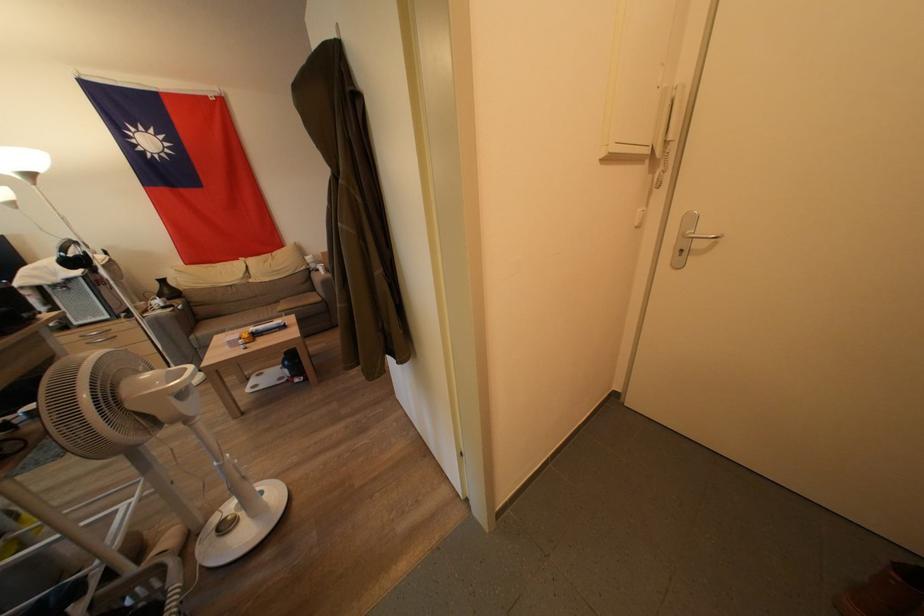
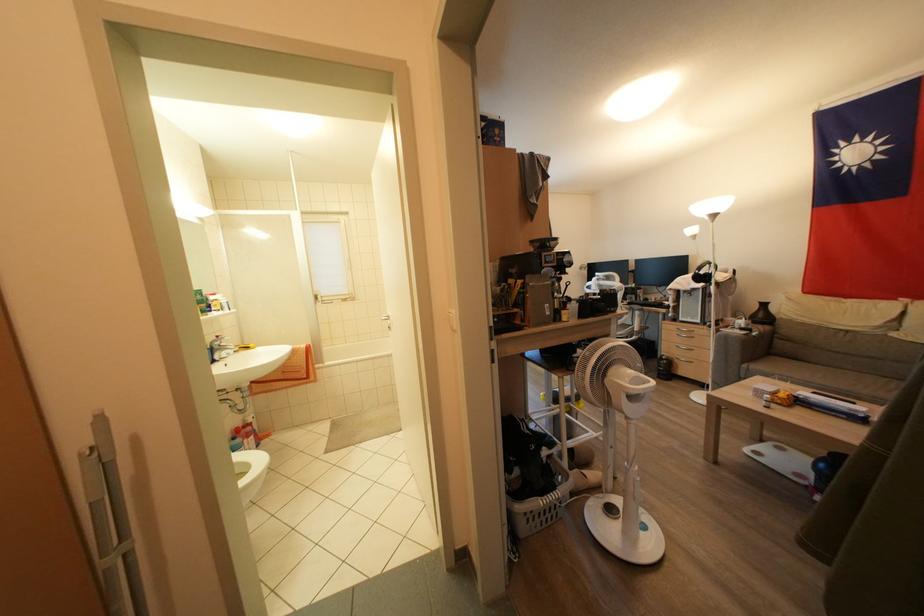
The point at [197,341] is marked in the first image. Where is the corresponding point in the second image?

(748, 370)